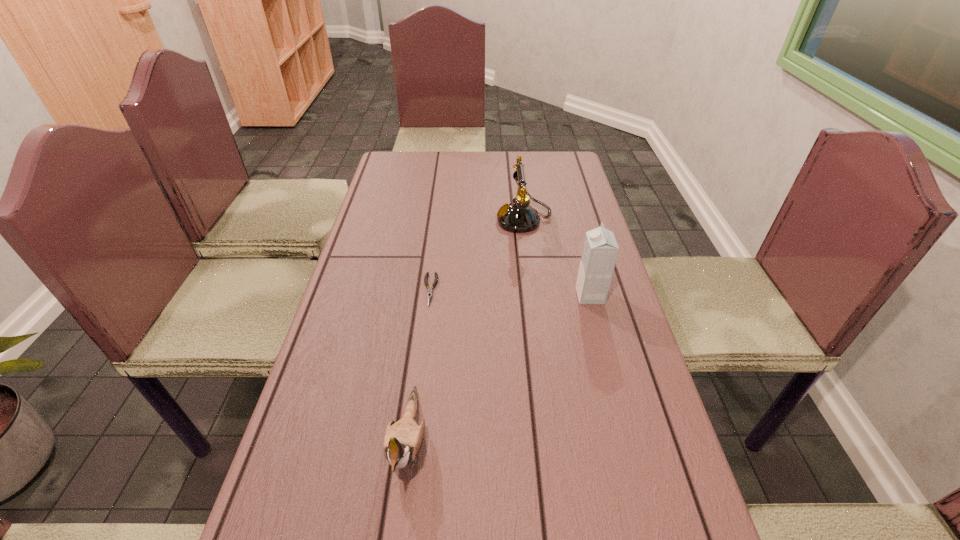
This screenshot has width=960, height=540. Identify the location of free space located on the dial of the telephone. (374, 219).

This screenshot has width=960, height=540. I want to click on vacant space located 0.140m on the dial of the telephone, so click(x=453, y=219).

Identify the location of free point located on the back of the shortest object. The height and width of the screenshot is (540, 960). (438, 227).

Where is `carton that is at the right edge`? The image size is (960, 540). carton that is at the right edge is located at coordinates (600, 250).

What are the coordinates of `telephone that is at the right edge` in the screenshot? It's located at (x=519, y=217).

This screenshot has height=540, width=960. In the image, there is a desktop. Find the location of `vacant space at the far edge`. vacant space at the far edge is located at coordinates (525, 163).

At what (x,y) coordinates should I click in order to perform the action: click on free space at the left edge. Please return your answer as a coordinate pair (x, y). Looking at the image, I should click on (361, 272).

This screenshot has width=960, height=540. Identify the location of free space at the right edge. [570, 210].

Where is `free space at the far left corner of the desktop`? The width and height of the screenshot is (960, 540). free space at the far left corner of the desktop is located at coordinates (380, 171).

The width and height of the screenshot is (960, 540). I want to click on free location at the far right corner, so click(550, 173).